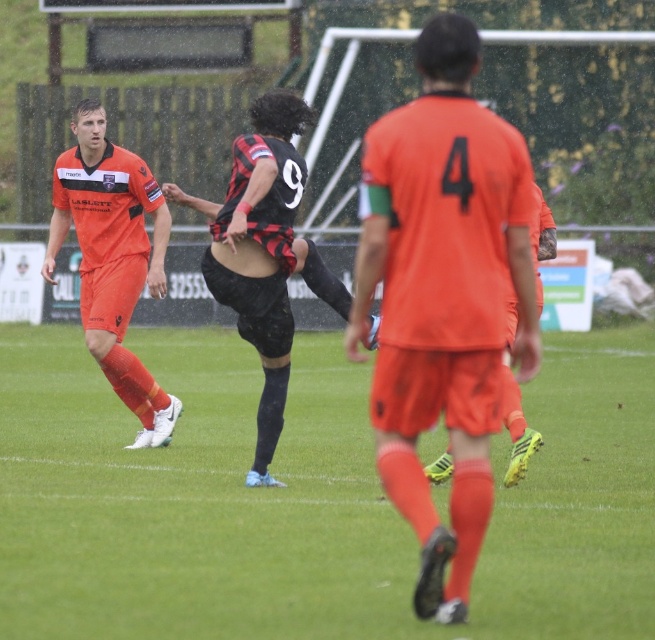
Is green grass at center above matte orange uniform at left?

A: Actually, green grass at center is below matte orange uniform at left.

Which is in front, point (286, 582) or point (88, 188)?

Point (286, 582) is in front.

Measure the distance between point (345,541) and camera.

The distance of point (345,541) from camera is 8.16 meters.

Where is `green grass at center`? green grass at center is located at coordinates (307, 499).

Who is positioned more to the right, orange matte jersey at center or matte orange shorts at center?

matte orange shorts at center is more to the right.

Between point (403, 497) and point (451, 456), which one is positioned behind?

The point (451, 456) is more distant.

Which is behind, point (402, 512) or point (514, 408)?

Point (514, 408)

Where is `orange matte jersey at center`? The height and width of the screenshot is (640, 655). orange matte jersey at center is located at coordinates (441, 296).

Is the position of green grass at center more distant than that of orange matte jersey at center?

No, green grass at center is in front of orange matte jersey at center.

Is green grass at center to the left of orange matte jersey at center from the viewer's perspective?

Yes, green grass at center is to the left of orange matte jersey at center.

Is point (316, 371) behind point (400, 161)?

Yes, it is.

You are a GUI agent. You are given a task and a screenshot of the screen. Output one action in this format:
    pyautogui.click(x=<x>, y=<y>)
    Task: Click on the green grass at center
    The height and width of the screenshot is (640, 655).
    Given the screenshot: What is the action you would take?
    pyautogui.click(x=307, y=499)